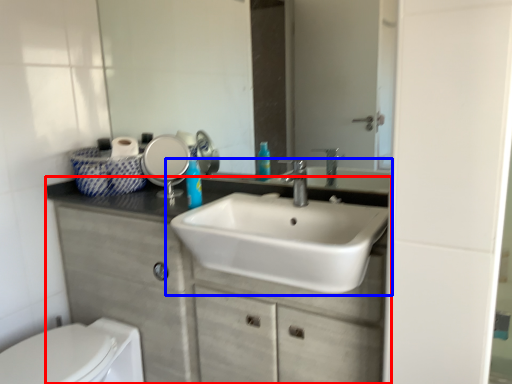
Question: Which point is closer to the camera, bathroom cabinet (highlighted by a red box) or sink (highlighted by a blue box)?

Choices:
 (A) bathroom cabinet
 (B) sink

Answer: (B)